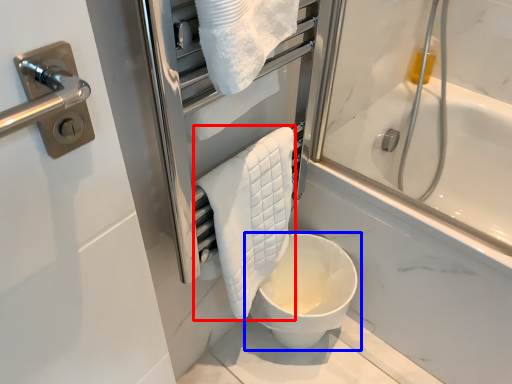
Question: Which object is further to the camera taking this photo, bath towel (highlighted by a red box) or toilet (highlighted by a blue box)?

Choices:
 (A) bath towel
 (B) toilet

Answer: (B)